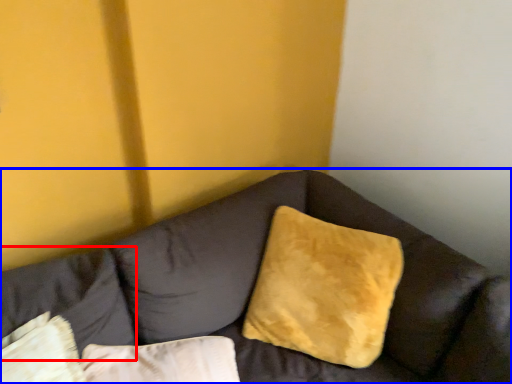
Question: Which object is further to the camera taking this photo, pillow (highlighted by a red box) or studio couch (highlighted by a blue box)?

Choices:
 (A) pillow
 (B) studio couch

Answer: (A)